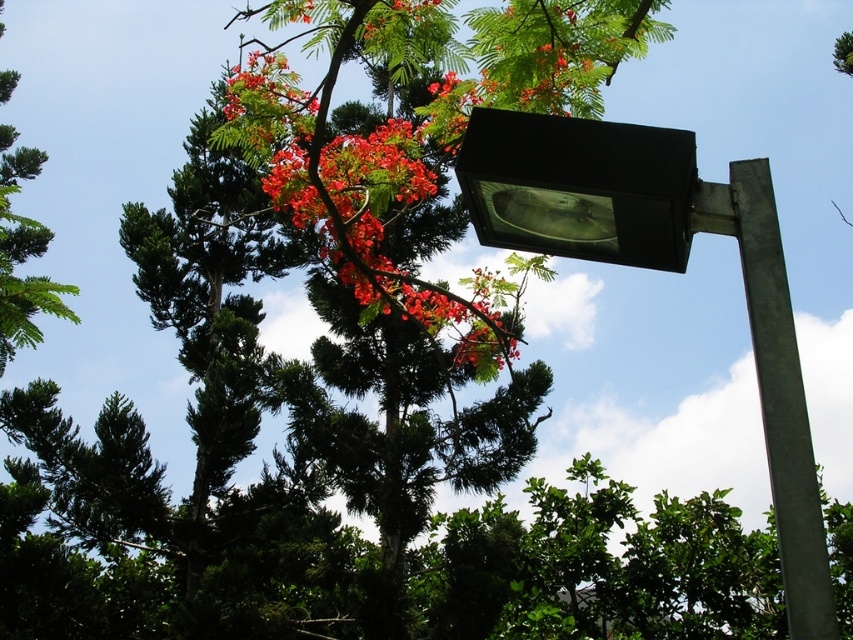
Question: Can you confirm if shiny red petals at upper center is smaller than black matte streetlight at upper right?

Choices:
 (A) yes
 (B) no

Answer: (B)

Question: Among these points, which one is nearest to the camera?

Choices:
 (A) (613, 262)
 (B) (558, 99)

Answer: (A)

Question: Estimate the real-world distances between objects in this image. Which object is farther from the shiny red petals at upper center?

Choices:
 (A) black matte streetlight at upper right
 (B) green concrete pole at center
 (C) black plastic lamp at upper right

Answer: (B)

Question: Does black matte streetlight at upper right come behind green concrete pole at center?

Choices:
 (A) yes
 (B) no

Answer: (A)

Question: Estimate the real-world distances between objects in this image. Which object is closer to the black plastic lamp at upper right?

Choices:
 (A) black matte streetlight at upper right
 (B) shiny red petals at upper center
 (C) green concrete pole at center
 (D) green leafy tree at upper left

Answer: (A)

Question: Does shiny red petals at upper center lie in front of black plastic lamp at upper right?

Choices:
 (A) no
 (B) yes

Answer: (A)